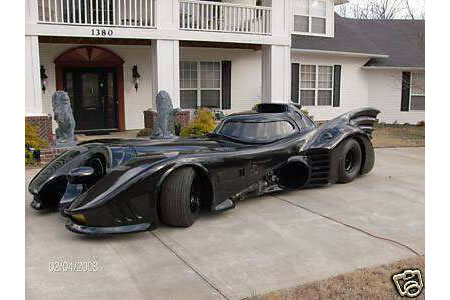
In order to click on shutters in this screenshot , I will do `click(227, 91)`, `click(296, 77)`, `click(337, 78)`, `click(406, 86)`.